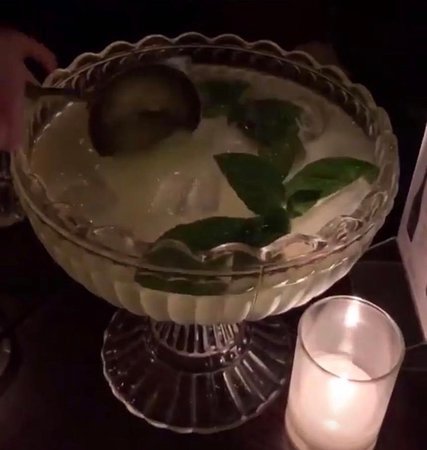
Locate an element on the screen. place to hold ladle is located at coordinates (36, 92).